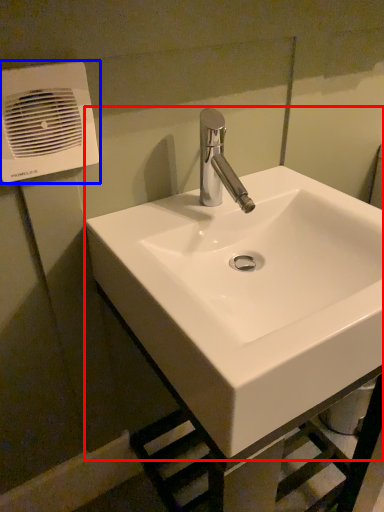
Question: Which object appears closest to the camera in this image, sink (highlighted by a red box) or air conditioning (highlighted by a blue box)?

Choices:
 (A) sink
 (B) air conditioning

Answer: (A)